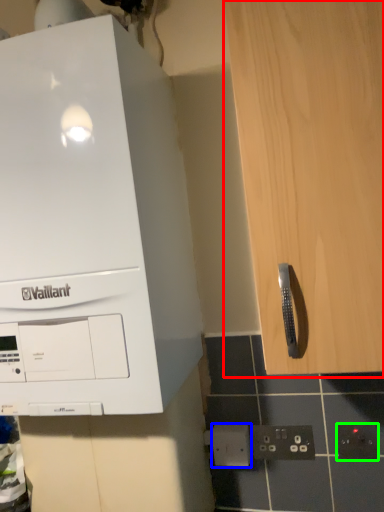
Question: Which object is positioned farthest from cabinetry (highlighted by a red box)? Select from electric outlet (highlighted by a blue box) and electric outlet (highlighted by a green box).

Choices:
 (A) electric outlet
 (B) electric outlet

Answer: (A)